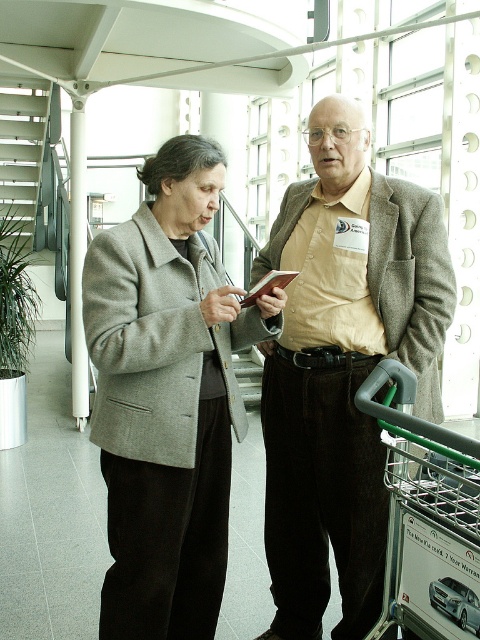
You are a delivery person who needs to place a package on the beige woolen blazer at center and the green metallic shopping cart at lower right. Which object can you place the package on without it falling off?

The beige woolen blazer at center is much taller than the green metallic shopping cart at lower right, so placing the package on the beige woolen blazer at center would be more stable and less likely to fall off.

In the scene shown: You are a tailor who needs to determine which garment is taller between the beige woolen blazer at center and the gray woolen coat at center. Based on the scene description, which one is taller?

The beige woolen blazer at center is taller than the gray woolen coat at center according to the description.

Based on the photo, you are a delivery person who needs to place a package in the green metallic shopping cart at lower right. The beige woolen blazer at center is blocking the path. Can you move the blazer to the right to clear the path?

The beige woolen blazer at center is already to the left of the green metallic shopping cart at lower right. Moving it further to the right would place it closer to the cart, but since the blazer is already positioned to the left of the cart, it may not be blocking the path. Check the exact positioning before moving anything.